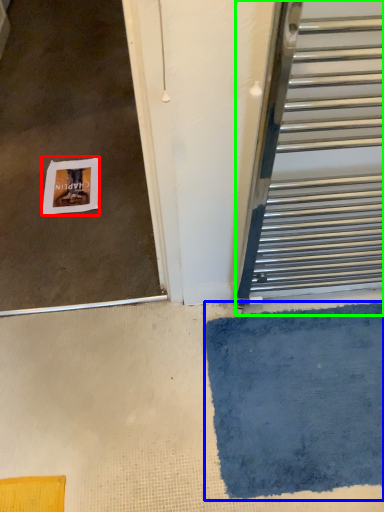
Question: Which object is positioned farthest from postcard (highlighted by a red box)? Select from bath mat (highlighted by a blue box) and door (highlighted by a green box).

Choices:
 (A) bath mat
 (B) door

Answer: (A)